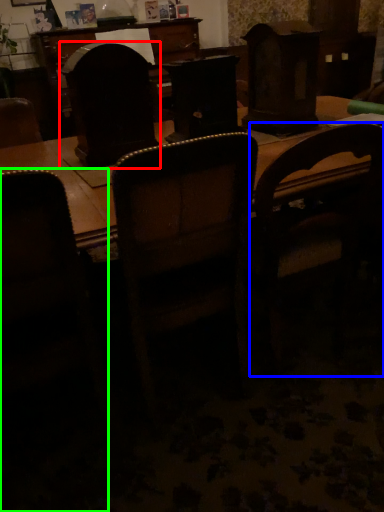
Question: Which object is positioned farthest from swivel chair (highlighted by a red box)? Select from chair (highlighted by a blue box) and chair (highlighted by a green box).

Choices:
 (A) chair
 (B) chair

Answer: (A)